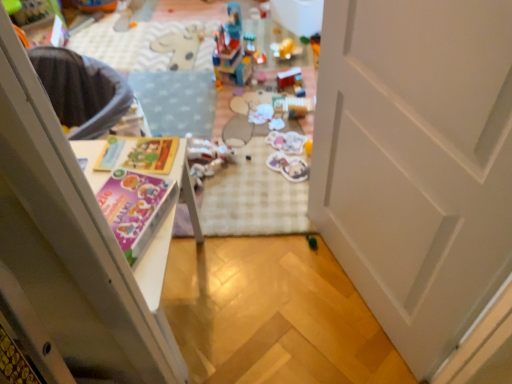
At what (x,y) coordinates should I click in order to perform the action: click on vacant area that lies between matte plastic stickers at center, which ranks as the fifth toy in top-to-bottom order, and smooth plastic toy at center, arranged as the second toy when viewed from the top. Please return your answer as a coordinate pair (x, y). Looking at the image, I should click on (284, 124).